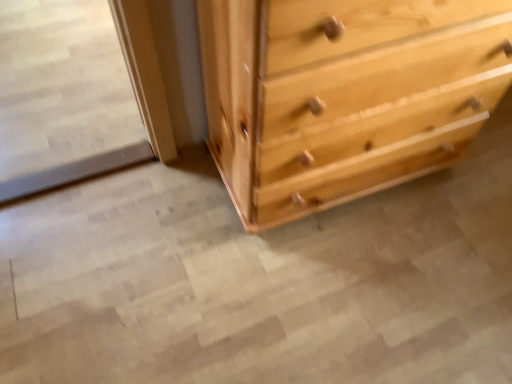
Locate an element on the screen. free point above clear glass screen door at left (from a real-world perspective) is located at coordinates (55, 66).